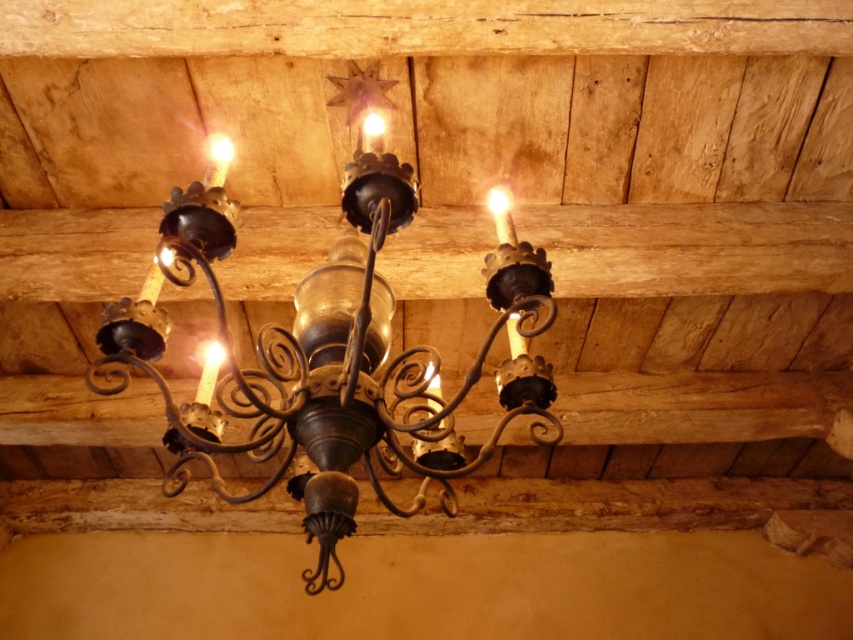
How far apart are matte glass light at upper center and matte gold candle at center?

matte glass light at upper center and matte gold candle at center are 15.09 inches apart.

Which is more to the left, matte glass light at upper center or matte gold candle at center?

matte gold candle at center

Does point (215, 150) come in front of point (221, 356)?

Yes, point (215, 150) is in front of point (221, 356).

Where is `matte glass light at upper center`? Image resolution: width=853 pixels, height=640 pixels. matte glass light at upper center is located at coordinates [x=219, y=148].

Between matte gold candle at center and matte gold light at upper center, which one has less height?

Standing shorter between the two is matte gold candle at center.

Does point (212, 358) lie in front of point (505, 198)?

No, (212, 358) is further to viewer.

Which is in front, point (207, 353) or point (508, 204)?

Point (508, 204) is more forward.

Find the location of a particular element. The image size is (853, 640). matte gold candle at center is located at coordinates (210, 353).

Between point (341, 305) and point (503, 193), which one is positioned behind?

Point (503, 193)

In the scene shown: Can you confirm if antique brass chandelier at center is taller than matte gold light at upper center?

Indeed, antique brass chandelier at center has a greater height compared to matte gold light at upper center.

Is point (289, 348) positioned after point (488, 200)?

No, it is not.

Find the location of a particular element. The height and width of the screenshot is (640, 853). antique brass chandelier at center is located at coordinates (349, 372).